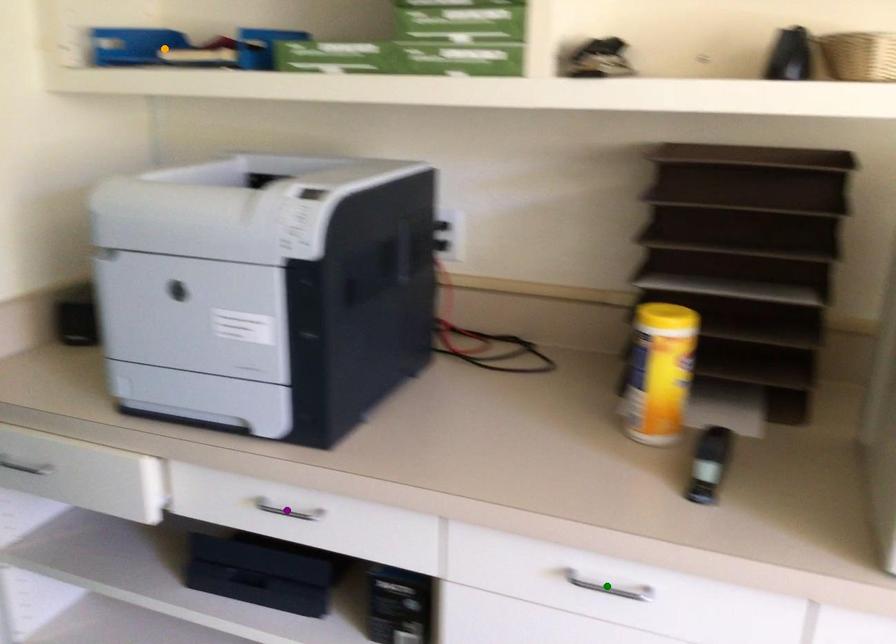
Order these from nearest to farthest:
- purple point
- orange point
- green point

green point, purple point, orange point